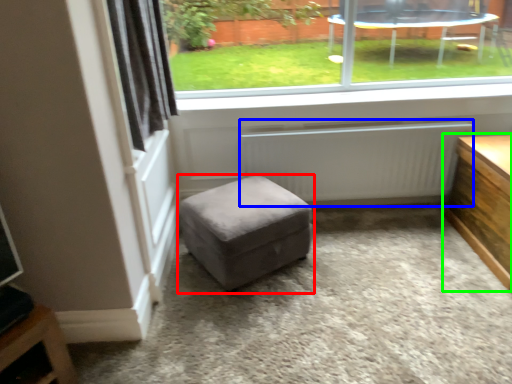
Question: Considering the real-world distances, which object is farthest from stool (highlighted by a red box)? radiator (highlighted by a blue box) or table (highlighted by a green box)?

Choices:
 (A) radiator
 (B) table

Answer: (B)